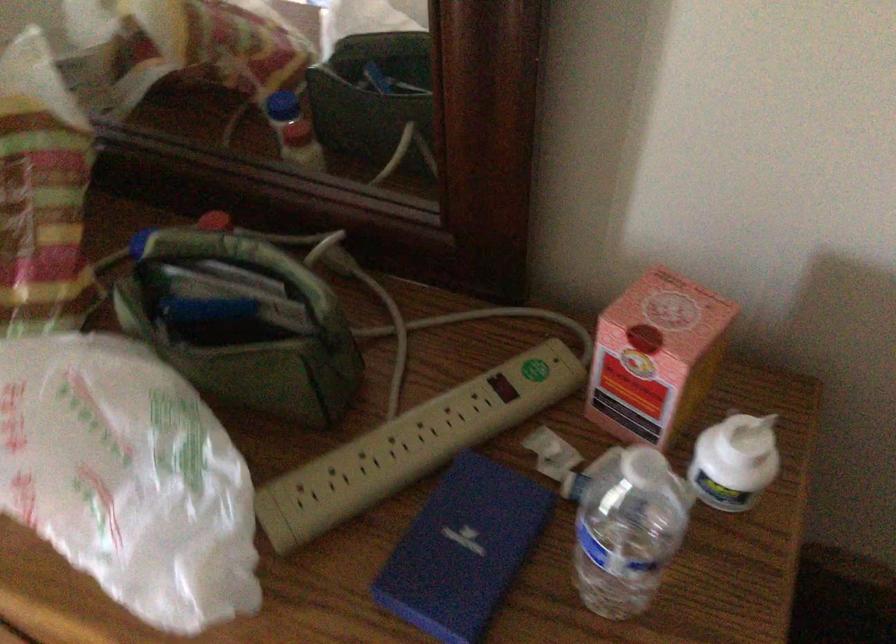
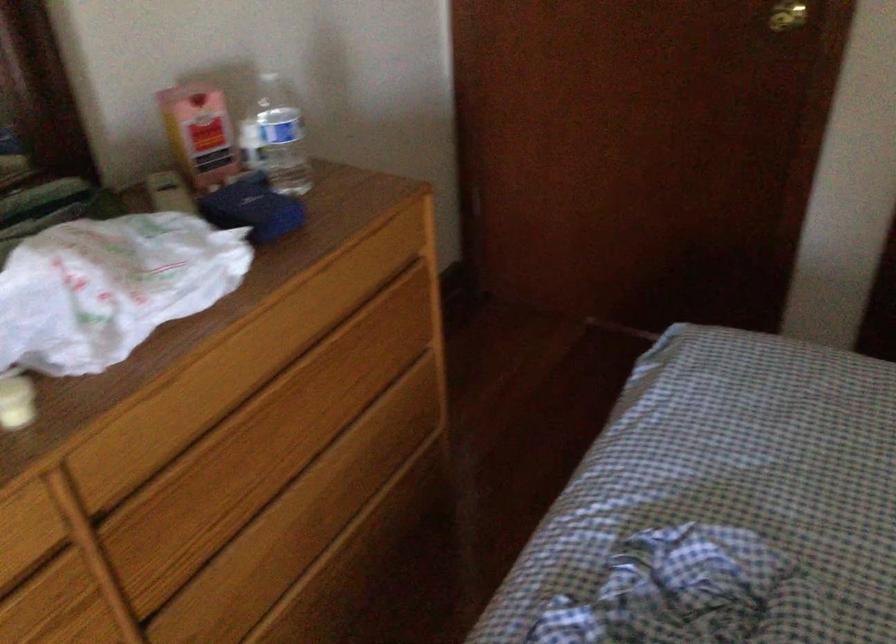
The point at (616, 374) is marked in the first image. Where is the corresponding point in the second image?

(200, 134)